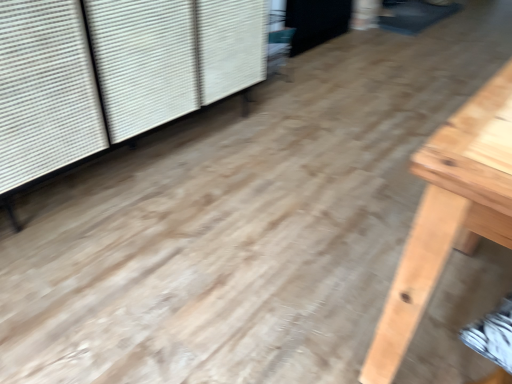
Where is `free location in front of white textured shutter at upper left`? Image resolution: width=512 pixels, height=384 pixels. free location in front of white textured shutter at upper left is located at coordinates (155, 291).